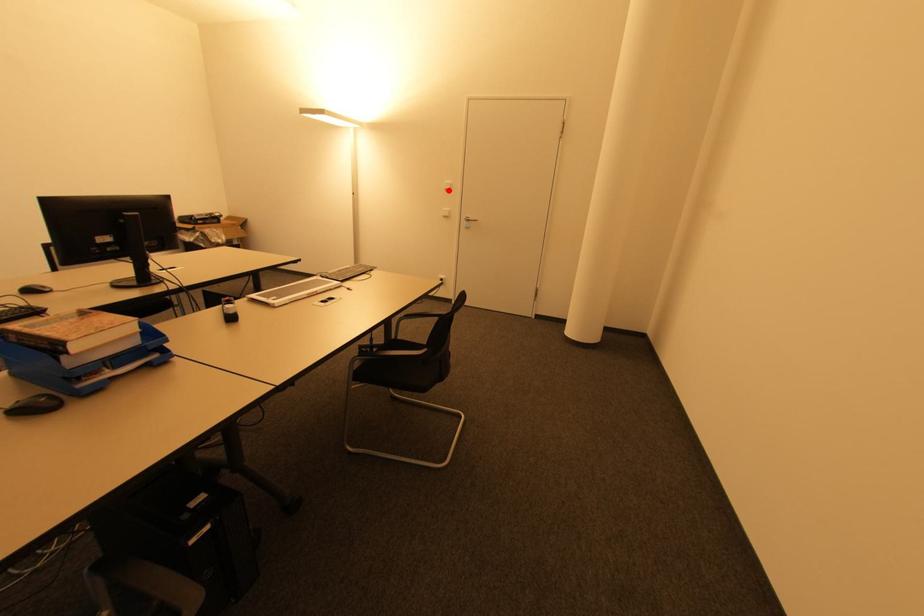
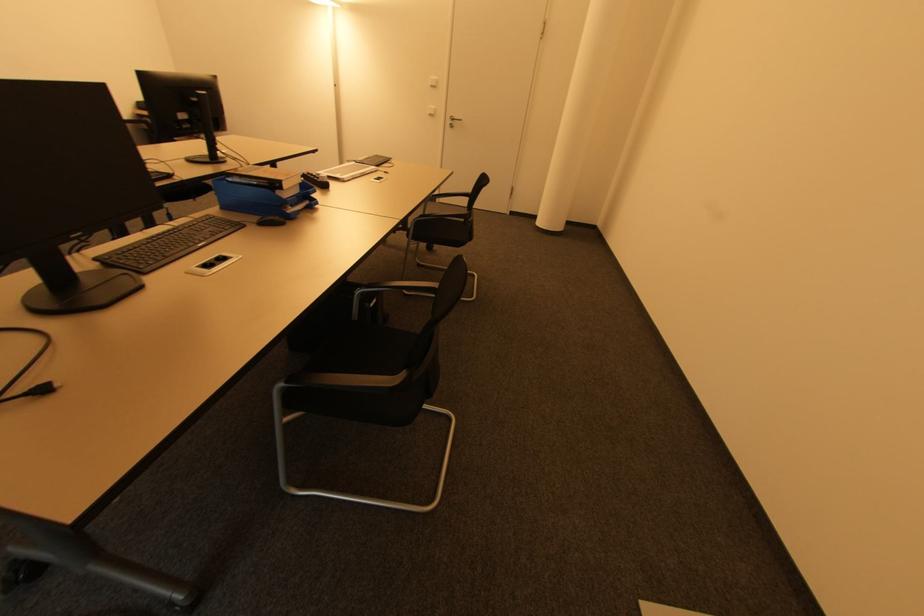
The point at the highlighted location is marked in the first image. Where is the corresponding point in the second image?

(434, 87)